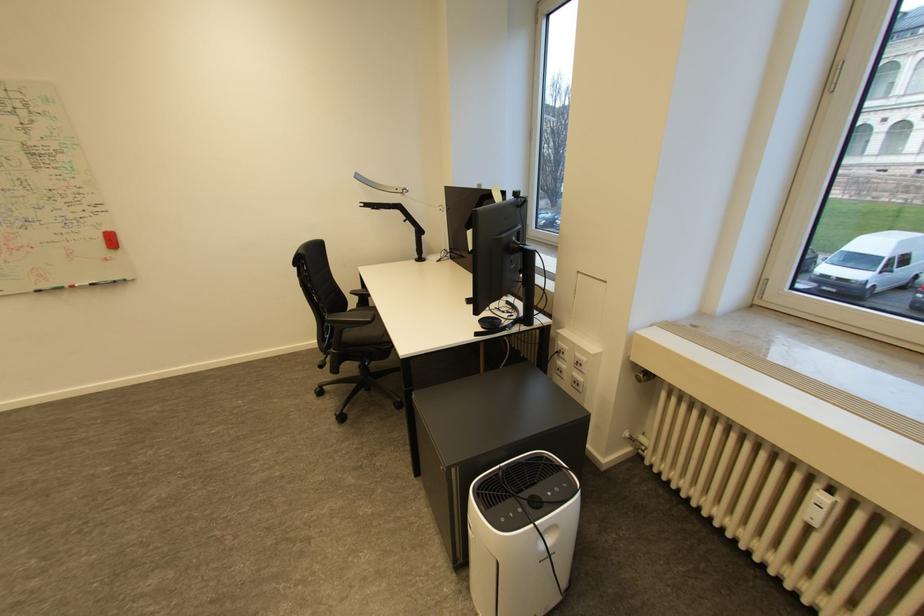
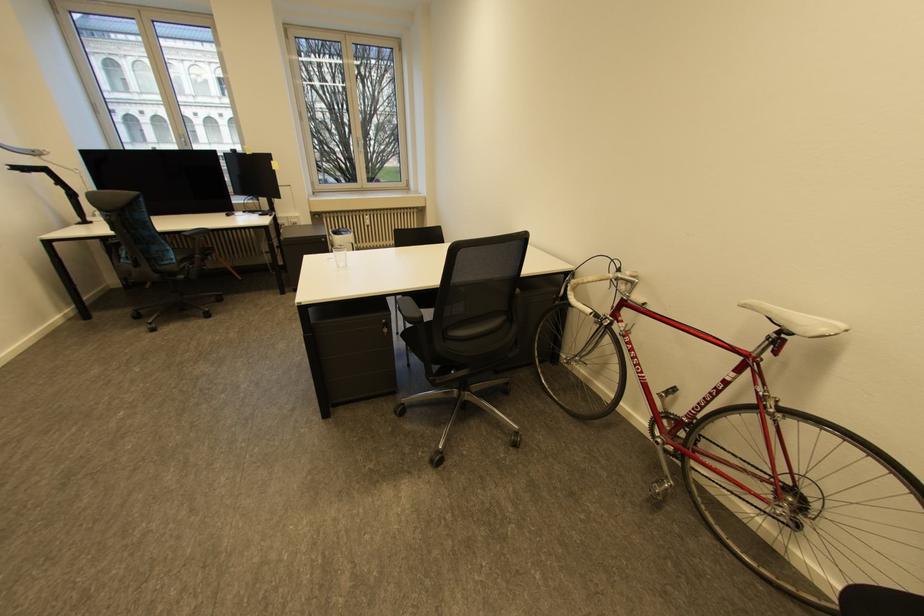
Where in the second image is the point corresponding to (816,525) from the first image?

(374, 227)